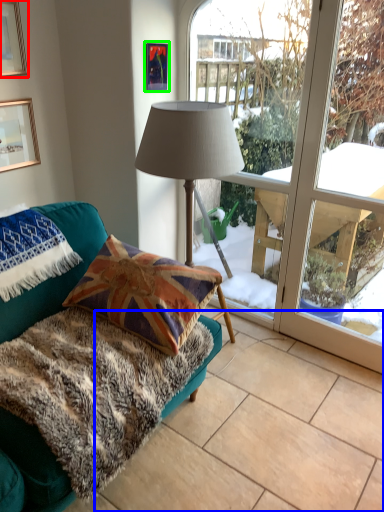
Question: Estimate the real-world distances between objects in this image. Which object is farther from picture frame (highlighted by a red box), tile (highlighted by a blue box) or picture frame (highlighted by a green box)?

Choices:
 (A) tile
 (B) picture frame

Answer: (A)